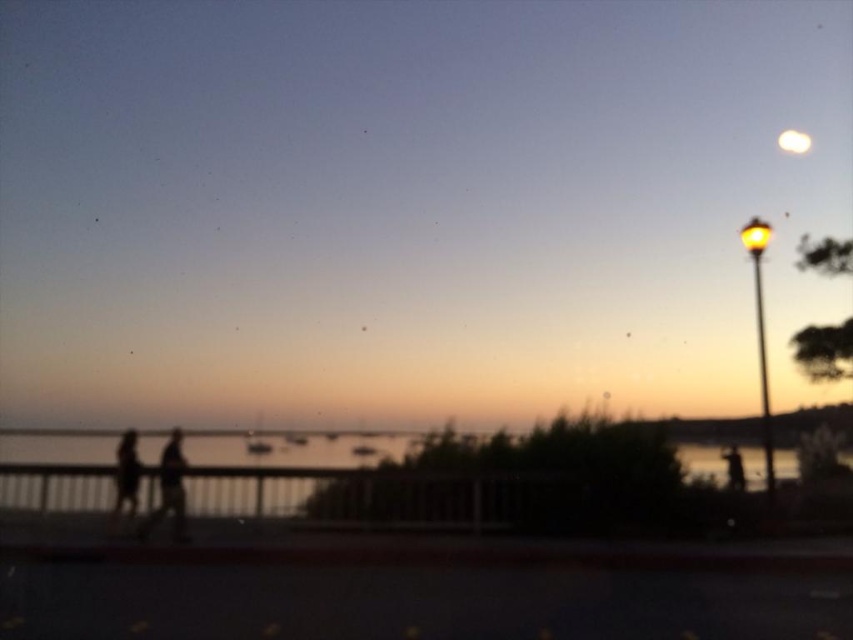
In the scene shown: Is silhouette figure at left positioned before silhouette figure at right?

Yes, it is.

The image size is (853, 640). What do you see at coordinates (126, 474) in the screenshot?
I see `silhouette figure at left` at bounding box center [126, 474].

What are the coordinates of `silhouette figure at left` in the screenshot? It's located at (126, 474).

Between silhouette figures at center and white glossy moon at upper right, which one is positioned higher?

white glossy moon at upper right is higher up.

Is point (132, 477) closer to viewer compared to point (805, 132)?

Yes, it is.

Find the location of a particular element. Image resolution: width=853 pixels, height=640 pixels. silhouette figures at center is located at coordinates (169, 490).

Is silhouette figure at left positioned at the back of white glossy moon at upper right?

No.

Describe the element at coordinates (126, 474) in the screenshot. I see `silhouette figure at left` at that location.

Is point (131, 451) behind point (808, 148)?

No, (131, 451) is closer to viewer.

Image resolution: width=853 pixels, height=640 pixels. In order to click on silhouette figure at left in this screenshot , I will do `click(126, 474)`.